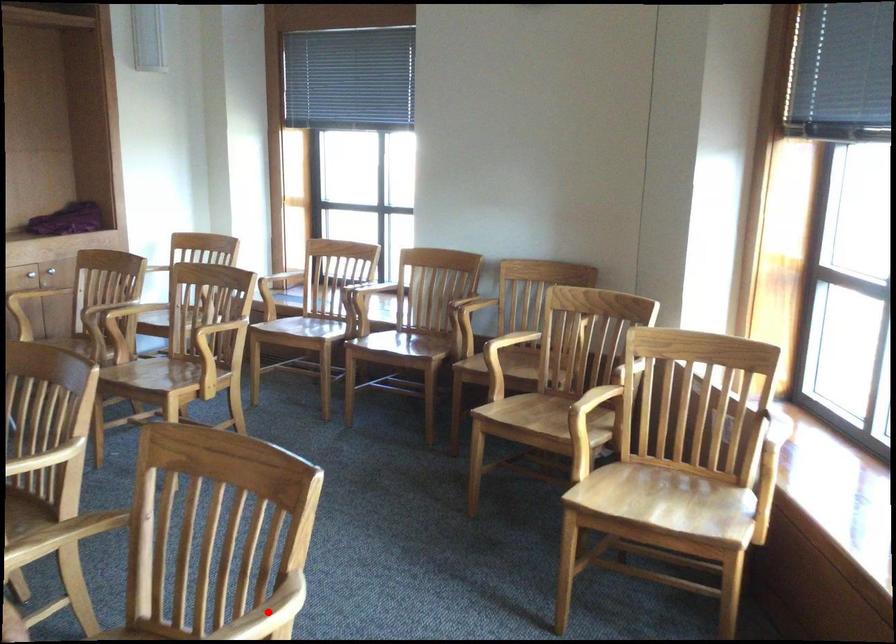
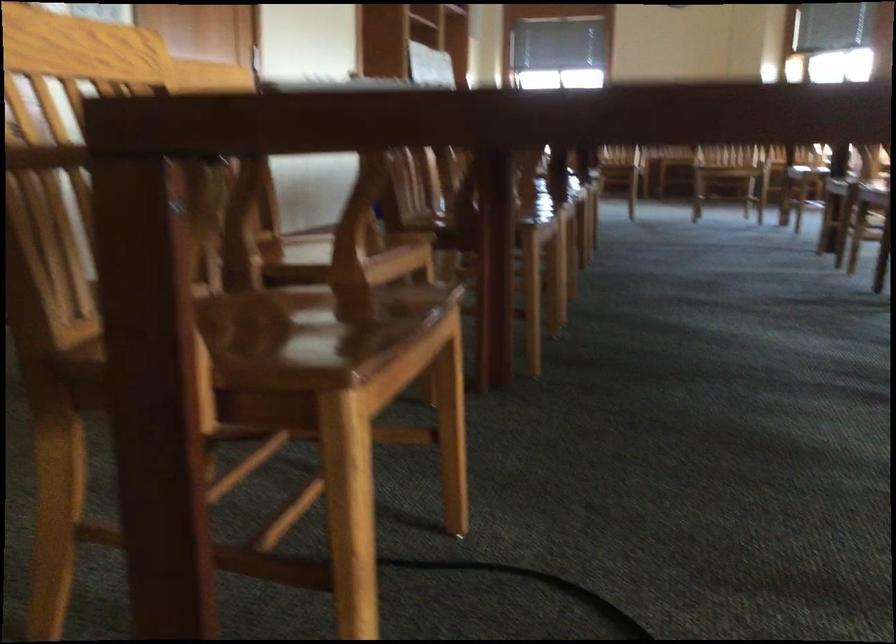
Question: I am providing you with two images of the same scene from different viewpoints. A red point is marked on the first image. Is the red point's position out of view in image 2?

Choices:
 (A) Yes
 (B) No

Answer: (A)